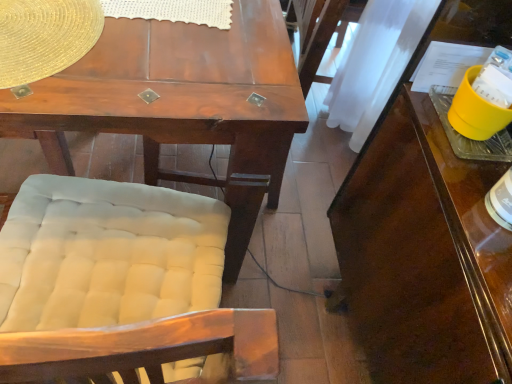
The height and width of the screenshot is (384, 512). Identify the location of wooden desk at center. (180, 104).

What do you see at coordinates (180, 104) in the screenshot?
I see `wooden desk at center` at bounding box center [180, 104].

Identify the location of wooden desk at center. The height and width of the screenshot is (384, 512). (180, 104).